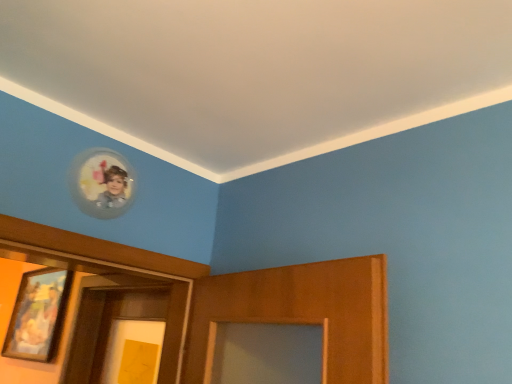
Question: Should I look upward or downward to see wooden framed painting at left, the first picture frame from the left?

Choices:
 (A) down
 (B) up

Answer: (A)

Question: Could you tell me if wooden framed painting at left, placed as the second picture frame when sorted from front to back, is turned towards clear glass portrait at upper left, which ranks as the 2th picture frame in back-to-front order?

Choices:
 (A) yes
 (B) no

Answer: (B)

Question: Would you say wooden framed painting at left, placed as the second picture frame when sorted from front to back, contains clear glass portrait at upper left, the 2th picture frame when ordered from left to right?

Choices:
 (A) no
 (B) yes

Answer: (A)

Question: Can you confirm if wooden framed painting at left, which is counted as the second picture frame, starting from the top, is positioned to the left of clear glass portrait at upper left, positioned as the first picture frame in front-to-back order?

Choices:
 (A) no
 (B) yes

Answer: (B)

Question: Is wooden framed painting at left, which is the second picture frame from right to left, turned away from clear glass portrait at upper left, which is the first picture frame in top-to-bottom order?

Choices:
 (A) yes
 (B) no

Answer: (B)

Question: Would you say wooden framed painting at left, positioned as the first picture frame in bottom-to-top order, is outside clear glass portrait at upper left, the 2th picture frame when ordered from left to right?

Choices:
 (A) no
 (B) yes

Answer: (B)

Question: Considering the relative sizes of wooden framed painting at left, the first picture frame from the left, and clear glass portrait at upper left, which ranks as the 2th picture frame in back-to-front order, in the image provided, is wooden framed painting at left, the first picture frame from the left, smaller than clear glass portrait at upper left, which ranks as the 2th picture frame in back-to-front order,?

Choices:
 (A) no
 (B) yes

Answer: (A)

Question: From a real-world perspective, is clear glass portrait at upper left, the 2th picture frame when ordered from left to right, located higher than wooden framed painting at left, which is the second picture frame from right to left?

Choices:
 (A) yes
 (B) no

Answer: (A)

Question: Is clear glass portrait at upper left, which ranks as the 2th picture frame in back-to-front order, at the left side of wooden framed painting at left, positioned as the first picture frame in bottom-to-top order?

Choices:
 (A) yes
 (B) no

Answer: (B)

Question: Is clear glass portrait at upper left, the 2th picture frame from the bottom, wider than wooden framed painting at left, placed as the second picture frame when sorted from front to back?

Choices:
 (A) yes
 (B) no

Answer: (B)

Question: Is clear glass portrait at upper left, the 2th picture frame when ordered from left to right, behind wooden framed painting at left, placed as the second picture frame when sorted from front to back?

Choices:
 (A) no
 (B) yes

Answer: (A)

Question: Would you say clear glass portrait at upper left, positioned as the first picture frame in front-to-back order, is a long distance from wooden framed painting at left, positioned as the first picture frame in bottom-to-top order?

Choices:
 (A) yes
 (B) no

Answer: (A)

Question: From the image's perspective, is clear glass portrait at upper left, the 2th picture frame from the bottom, on wooden framed painting at left, acting as the 1th picture frame starting from the back?

Choices:
 (A) yes
 (B) no

Answer: (A)

Question: From a real-world perspective, is clear glass portrait at upper left, the first picture frame in the right-to-left sequence, physically located above or below wooden framed painting at left, which is counted as the second picture frame, starting from the top?

Choices:
 (A) below
 (B) above

Answer: (B)